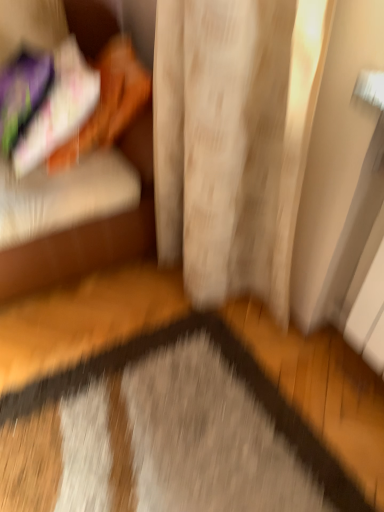
Question: In terms of height, does velvet orange couch at left look taller or shorter compared to gray textured mat at center?

Choices:
 (A) short
 (B) tall

Answer: (B)

Question: Considering the relative positions of velvet orange couch at left and gray textured mat at center in the image provided, is velvet orange couch at left to the left or to the right of gray textured mat at center?

Choices:
 (A) right
 (B) left

Answer: (B)

Question: Does point (117, 239) appear closer or farther from the camera than point (110, 354)?

Choices:
 (A) farther
 (B) closer

Answer: (A)

Question: Visually, is gray textured mat at center positioned to the left or to the right of velvet orange couch at left?

Choices:
 (A) left
 (B) right

Answer: (B)

Question: Is gray textured mat at center in front of or behind velvet orange couch at left in the image?

Choices:
 (A) front
 (B) behind

Answer: (A)

Question: In terms of size, does gray textured mat at center appear bigger or smaller than velvet orange couch at left?

Choices:
 (A) big
 (B) small

Answer: (B)

Question: From the image's perspective, is gray textured mat at center above or below velvet orange couch at left?

Choices:
 (A) above
 (B) below

Answer: (B)